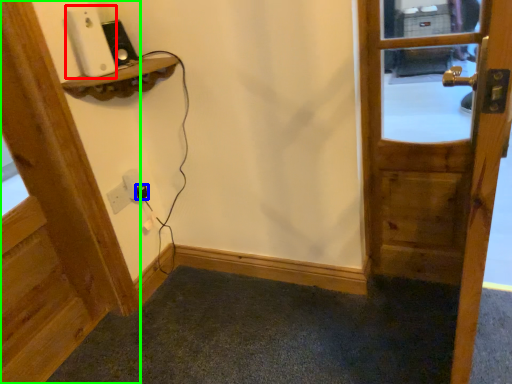
Question: Which is nearer to the ipod (highlighted by a red box)? plug (highlighted by a blue box) or door (highlighted by a green box).

Choices:
 (A) plug
 (B) door

Answer: (B)